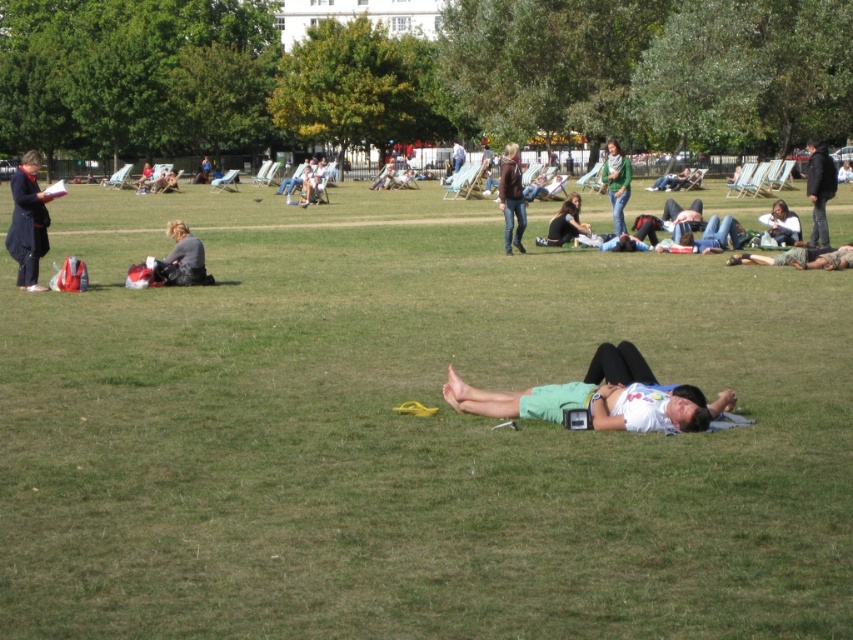
You are planning to set up a picnic blanket in the park. The picnic blanket is the size of the matte black jacket at center. Based on the scene, will the green grass at center provide enough space for the blanket?

The green grass at center is larger in size than the matte black jacket at center. Since the picnic blanket is the size of the matte black jacket at center, the green grass at center has enough space to accommodate the blanket.

You are a photographer trying to capture a group photo of the people in the park. You need to ensure that both the white matte shirt at center and the dark blue jacket at right are clearly visible in the frame. Given their sizes, which object should you focus on first to ensure proper focus and exposure?

The white matte shirt at center has a smaller size compared to dark blue jacket at right, so you should focus on the white matte shirt at center first to ensure its details are captured clearly before adjusting for the larger dark blue jacket at right.

You are standing at the point marked as point (407, 433) in the park. What is the terrain like under your feet?

The terrain at point (407, 433) is green grass at center.